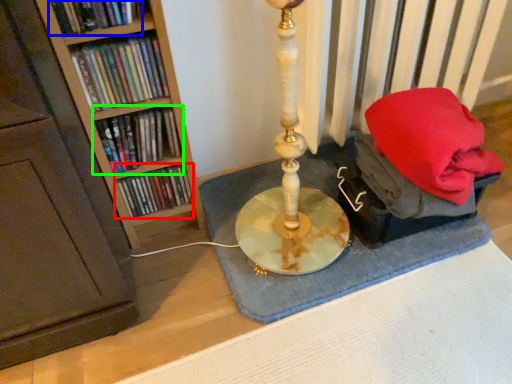
Question: Considering the real-world distances, which object is farthest from book (highlighted by a red box)? book (highlighted by a blue box) or book (highlighted by a green box)?

Choices:
 (A) book
 (B) book

Answer: (A)